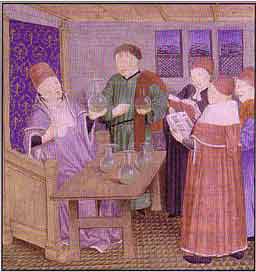
You are a GUI agent. You are given a task and a screenshot of the screen. Output one action in this format:
    pyautogui.click(x=<x>, y=<y>)
    Task: Click on the painting
    The height and width of the screenshot is (272, 256).
    Given the screenshot: What is the action you would take?
    pyautogui.click(x=119, y=14)